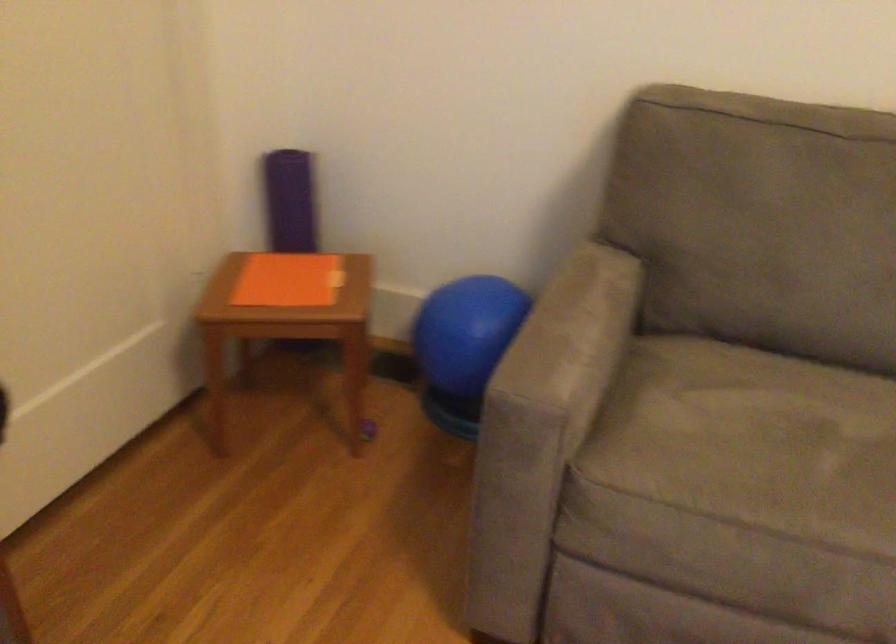
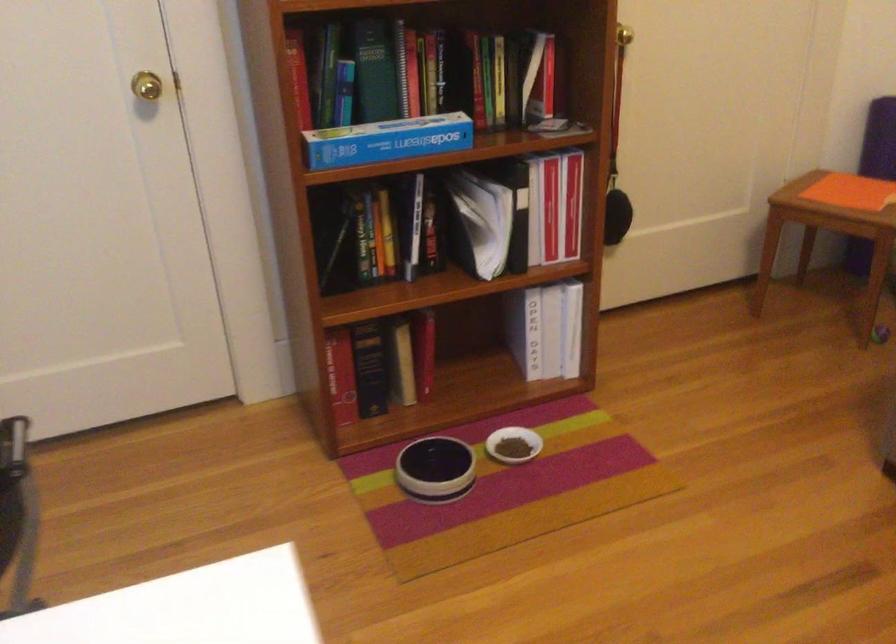
Locate, in the second image, the point that corresponds to (x=286, y=290) in the first image.

(840, 196)